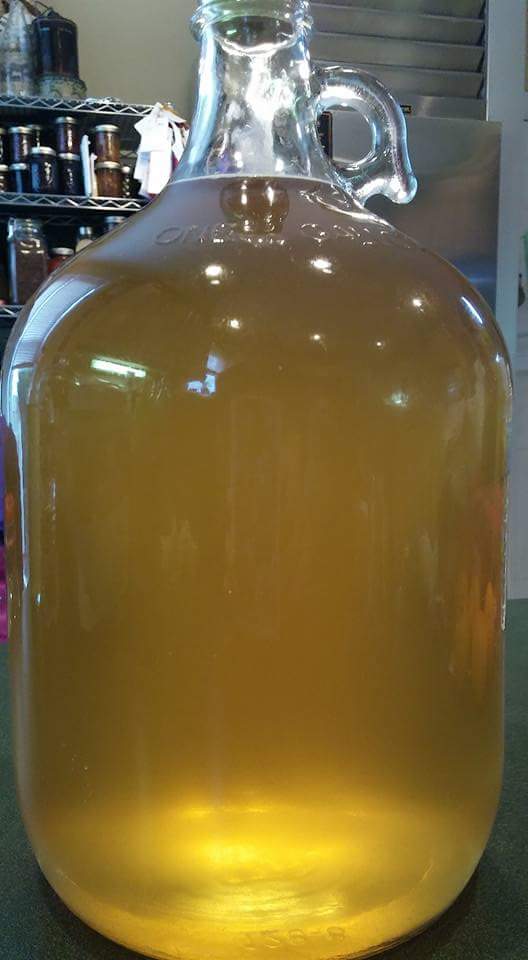
The width and height of the screenshot is (528, 960). I want to click on papers, so click(x=149, y=131), click(x=159, y=168), click(x=142, y=172), click(x=177, y=150).